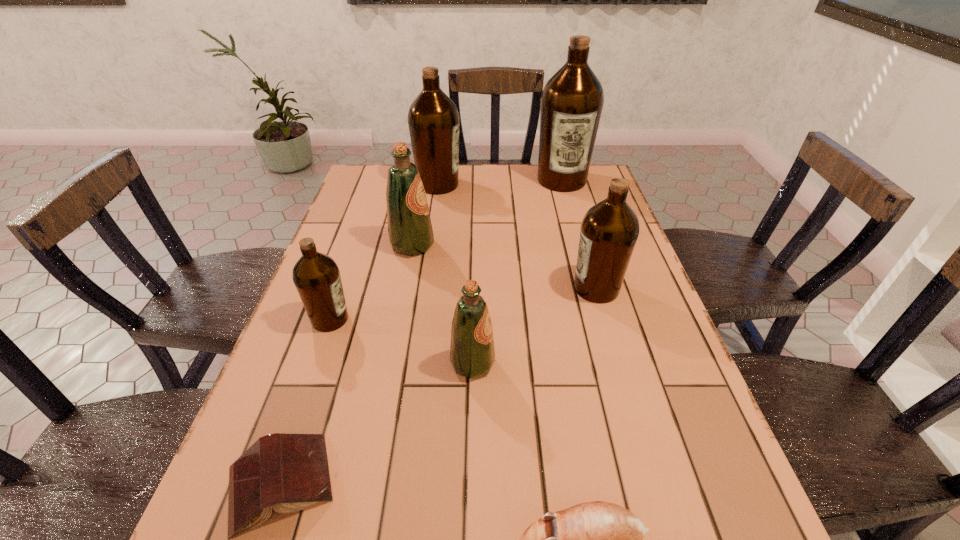
The height and width of the screenshot is (540, 960). Identify the location of the tallest object. (572, 100).

This screenshot has width=960, height=540. I want to click on the tallest olive oil, so click(572, 100).

Locate an element on the screen. The width and height of the screenshot is (960, 540). the second brown olive oil from left to right is located at coordinates (433, 119).

Locate an element on the screen. the second tallest object is located at coordinates click(433, 119).

You are a GUI agent. You are given a task and a screenshot of the screen. Output one action in this format:
    pyautogui.click(x=<x>, y=<y>)
    Task: Click on the sixth nearest object
    This screenshot has width=960, height=540.
    Given the screenshot: What is the action you would take?
    pyautogui.click(x=410, y=232)

Image resolution: width=960 pixels, height=540 pixels. Identify the location of the third farthest olive oil. (410, 232).

The width and height of the screenshot is (960, 540). Identify the location of the third biggest brown olive oil. (609, 231).

At what (x,y) coordinates should I click in order to perform the action: click on the sixth farthest object. Please return your answer as a coordinate pair (x, y). The image size is (960, 540). Looking at the image, I should click on (472, 354).

The image size is (960, 540). What are the coordinates of `the right green olive oil` in the screenshot? It's located at (472, 354).

Where is `the smallest brown olive oil`? The image size is (960, 540). the smallest brown olive oil is located at coordinates (316, 276).